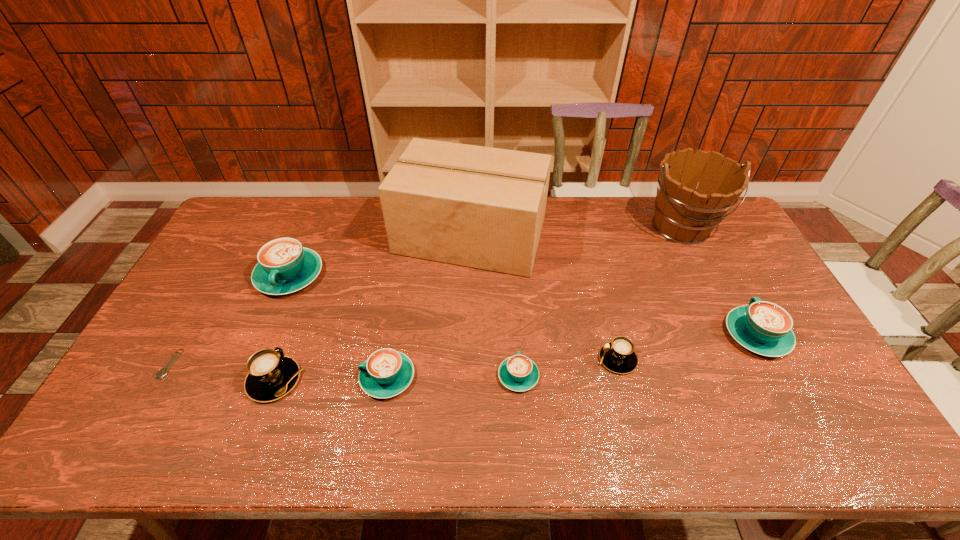
Identify which object is the third nearest to the wine bucket. Please provide its 2D coordinates. Your answer should be formatted as a tuple, i.e. [(x, y)], where the tuple contains the x and y coordinates of a point satisfying the conditions above.

[(618, 356)]

Where is `object that stands as the eighth closest to the left black cappuccino`? This screenshot has width=960, height=540. object that stands as the eighth closest to the left black cappuccino is located at coordinates (765, 328).

Select which cappuccino is the fifth closest to the second turquoise cappuccino from left to right. Please provide its 2D coordinates. Your answer should be formatted as a tuple, i.e. [(x, y)], where the tuple contains the x and y coordinates of a point satisfying the conditions above.

[(765, 328)]

At what (x,y) coordinates should I click in order to perform the action: click on the third closest cappuccino relative to the second turquoise cappuccino from left to right. Please return your answer as a coordinate pair (x, y). Looking at the image, I should click on (284, 266).

Image resolution: width=960 pixels, height=540 pixels. What are the coordinates of `turquoise cappuccino that is the third closest to the tallest cappuccino` in the screenshot? It's located at (765, 328).

Point out which turquoise cappuccino is positioned as the third nearest to the watch. Please provide its 2D coordinates. Your answer should be formatted as a tuple, i.e. [(x, y)], where the tuple contains the x and y coordinates of a point satisfying the conditions above.

[(518, 373)]

Where is `vacant space that satisfies the following two spatial constraints: 1. on the front side of the box; 2. with the handle on the right side of the fourth cappuccino from right to left`? This screenshot has height=540, width=960. vacant space that satisfies the following two spatial constraints: 1. on the front side of the box; 2. with the handle on the right side of the fourth cappuccino from right to left is located at coordinates (467, 377).

Locate an element on the screen. free space that satisfies the following two spatial constraints: 1. on the back side of the seventh object from left to right; 2. on the right side of the bigger black cappuccino is located at coordinates (282, 359).

Where is `vacant area that satisfies the following two spatial constraints: 1. with the handle on the right side of the left black cappuccino; 2. on the right side of the farthest cappuccino`? The image size is (960, 540). vacant area that satisfies the following two spatial constraints: 1. with the handle on the right side of the left black cappuccino; 2. on the right side of the farthest cappuccino is located at coordinates (246, 380).